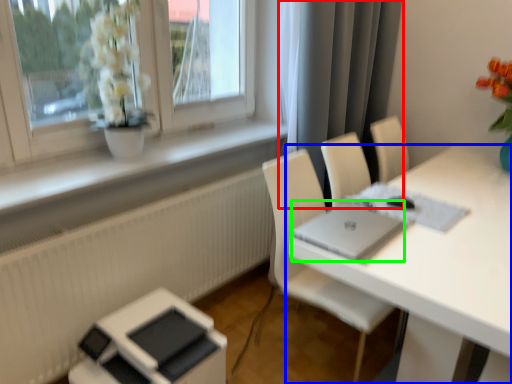
Question: Which object is positioned farthest from curtain (highlighted by a red box)? Select from table (highlighted by a blue box) and laptop (highlighted by a green box).

Choices:
 (A) table
 (B) laptop

Answer: (B)